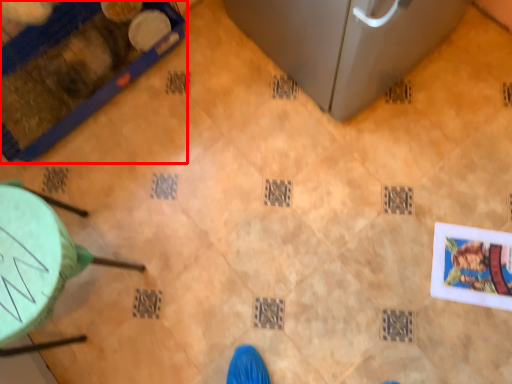
Question: In this image, where is furniture (annotated by the red box) located relative to furniture?

Choices:
 (A) right
 (B) left

Answer: (B)